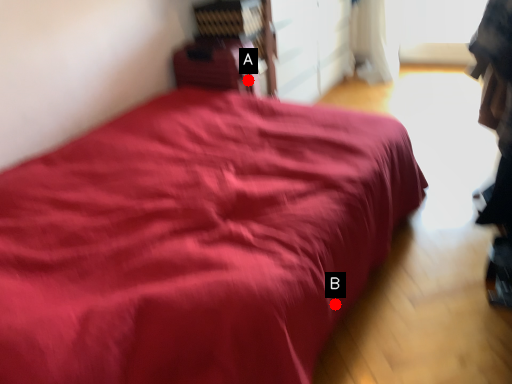
Question: Two points are circled on the image, labeled by A and B beside each circle. Which point is farther from the camera taking this photo?

Choices:
 (A) A is further
 (B) B is further

Answer: (A)